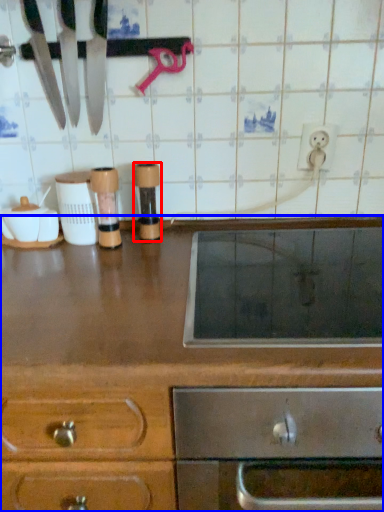
Question: Which object is further to the camera taking this photo, appliance (highlighted by a red box) or cabinetry (highlighted by a blue box)?

Choices:
 (A) appliance
 (B) cabinetry

Answer: (A)